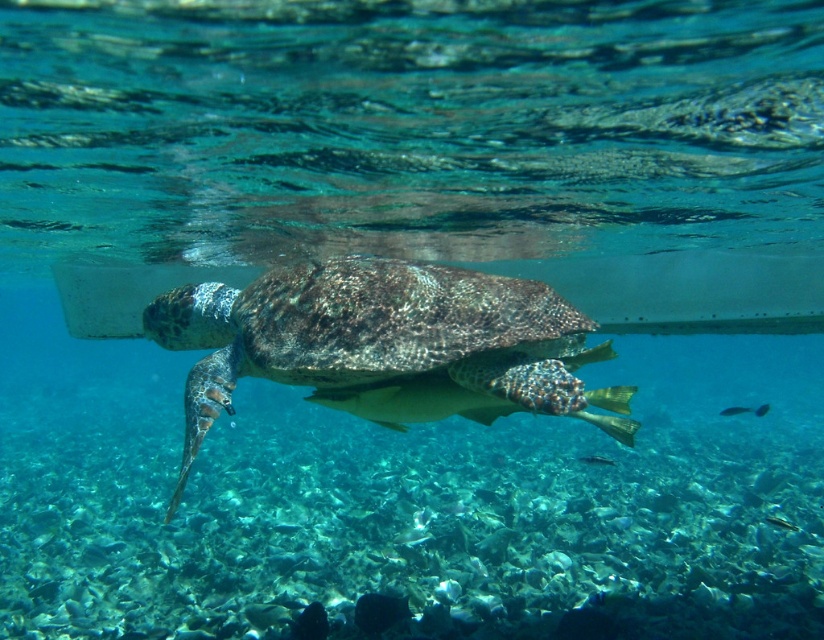
Question: Which object is farther from the camera taking this photo?

Choices:
 (A) shiny blue fish at lower right
 (B) shiny silver fish at center

Answer: (B)

Question: Which of the following is the farthest from the observer?

Choices:
 (A) (756, 412)
 (B) (722, 413)
 (C) (631, 392)

Answer: (A)

Question: Is textured brown tortoise at center closer to camera compared to shiny silver fish at center?

Choices:
 (A) no
 (B) yes

Answer: (B)

Question: Which is farther from the shiny blue fish at lower right?

Choices:
 (A) shiny silver fish at center
 (B) textured brown tortoise at center

Answer: (B)

Question: Can you confirm if shiny blue fish at lower right is positioned below shiny silver fish at center?

Choices:
 (A) no
 (B) yes

Answer: (B)

Question: Is shiny blue fish at lower right above shiny silver fish at center?

Choices:
 (A) yes
 (B) no

Answer: (B)